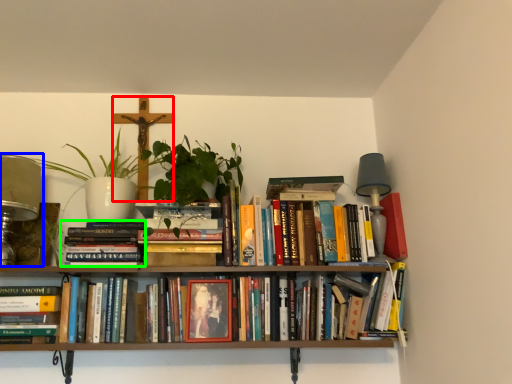
Question: Based on their relative distances, which object is farther from crucifix (highlighted by a red box)? Choose from table lamp (highlighted by a blue box) and book (highlighted by a green box).

Choices:
 (A) table lamp
 (B) book

Answer: (A)